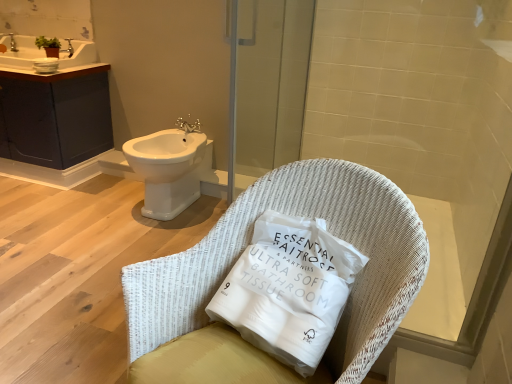
Question: From a real-world perspective, is silver metallic faucet at upper center beneath transparent glass screen door at upper center?

Choices:
 (A) yes
 (B) no

Answer: (A)

Question: Is silver metallic faucet at upper center shorter than transparent glass screen door at upper center?

Choices:
 (A) yes
 (B) no

Answer: (A)

Question: Does silver metallic faucet at upper center appear on the left side of transparent glass screen door at upper center?

Choices:
 (A) no
 (B) yes

Answer: (B)

Question: Are silver metallic faucet at upper center and transparent glass screen door at upper center beside each other?

Choices:
 (A) yes
 (B) no

Answer: (B)

Question: Is the depth of silver metallic faucet at upper center greater than that of transparent glass screen door at upper center?

Choices:
 (A) no
 (B) yes

Answer: (B)

Question: In terms of height, does dark gray matte cabinet at upper left look taller or shorter compared to white ceramic sink at upper left?

Choices:
 (A) tall
 (B) short

Answer: (A)

Question: Based on their sizes in the image, would you say dark gray matte cabinet at upper left is bigger or smaller than white ceramic sink at upper left?

Choices:
 (A) big
 (B) small

Answer: (A)

Question: In terms of width, does dark gray matte cabinet at upper left look wider or thinner when compared to white ceramic sink at upper left?

Choices:
 (A) thin
 (B) wide

Answer: (B)

Question: From the image's perspective, is dark gray matte cabinet at upper left positioned above or below white ceramic sink at upper left?

Choices:
 (A) below
 (B) above

Answer: (A)

Question: In terms of width, does silver metallic faucet at upper center look wider or thinner when compared to white woven pillow at center?

Choices:
 (A) wide
 (B) thin

Answer: (B)

Question: From their relative heights in the image, would you say silver metallic faucet at upper center is taller or shorter than white woven pillow at center?

Choices:
 (A) tall
 (B) short

Answer: (B)

Question: From a real-world perspective, is silver metallic faucet at upper center above or below white woven pillow at center?

Choices:
 (A) above
 (B) below

Answer: (B)

Question: Relative to white woven pillow at center, is silver metallic faucet at upper center in front or behind?

Choices:
 (A) behind
 (B) front

Answer: (A)

Question: From the image's perspective, is silver metallic faucet at upper center positioned above or below white glossy bidet at left?

Choices:
 (A) above
 (B) below

Answer: (A)

Question: Considering their positions, is silver metallic faucet at upper center located in front of or behind white glossy bidet at left?

Choices:
 (A) behind
 (B) front

Answer: (A)